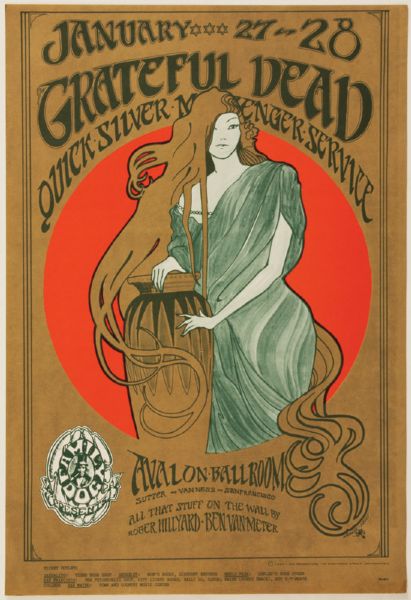
Find the location of a particular element. This screenshot has width=411, height=600. vase is located at coordinates (168, 318).